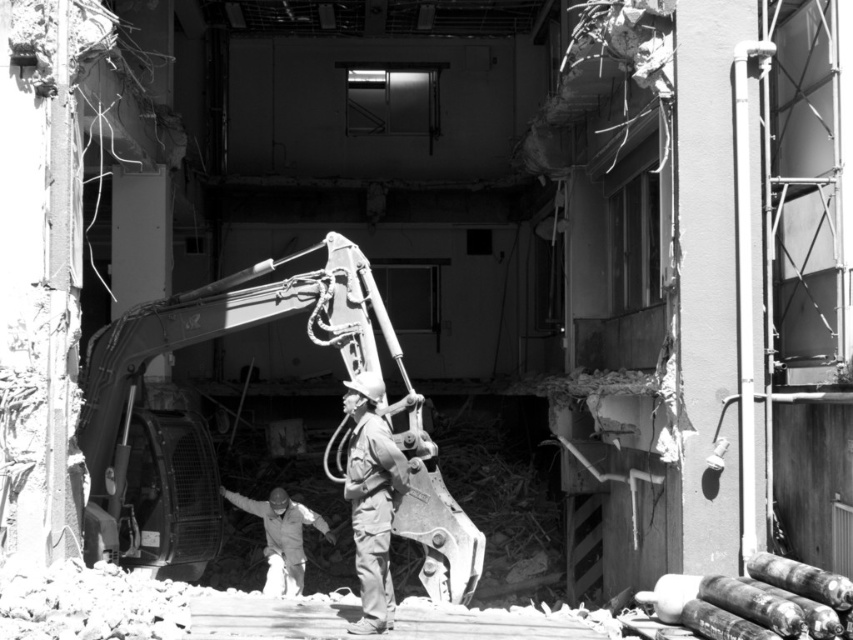
Question: Which point is closer to the camera taking this photo?

Choices:
 (A) (x=358, y=269)
 (B) (x=358, y=472)
 (C) (x=296, y=582)

Answer: (B)

Question: Does camouflage fabric uniform at center appear on the left side of white hard hat at center?

Choices:
 (A) no
 (B) yes

Answer: (A)

Question: Is metallic gray excavator at center further to camera compared to camouflage fabric uniform at center?

Choices:
 (A) no
 (B) yes

Answer: (B)

Question: Which point is closer to the camera?

Choices:
 (A) metallic gray excavator at center
 (B) white hard hat at center

Answer: (A)

Question: Can you confirm if metallic gray excavator at center is positioned to the right of white hard hat at center?

Choices:
 (A) yes
 (B) no

Answer: (A)

Question: Which point appears closest to the camera in this image?

Choices:
 (A) (355, 285)
 (B) (361, 545)
 (C) (282, 512)

Answer: (B)